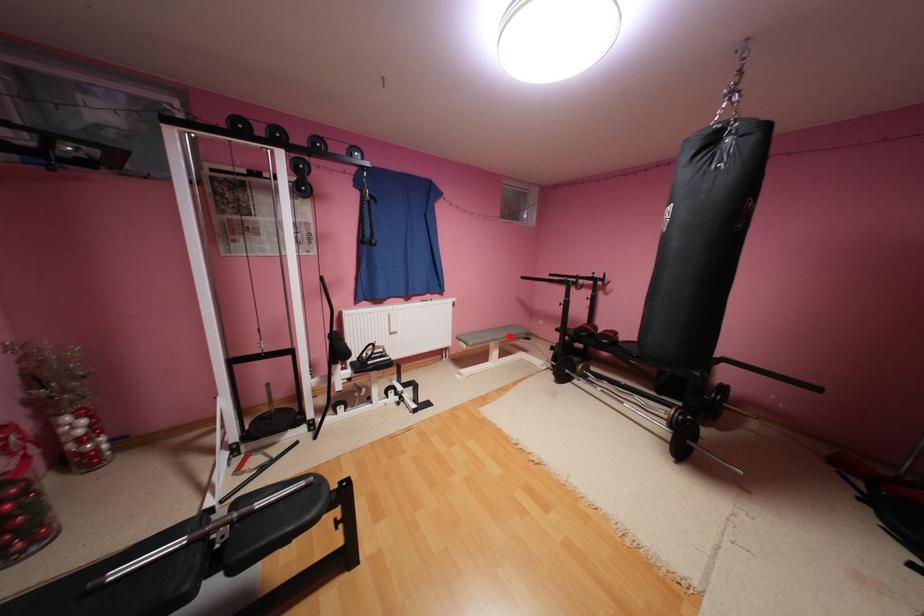
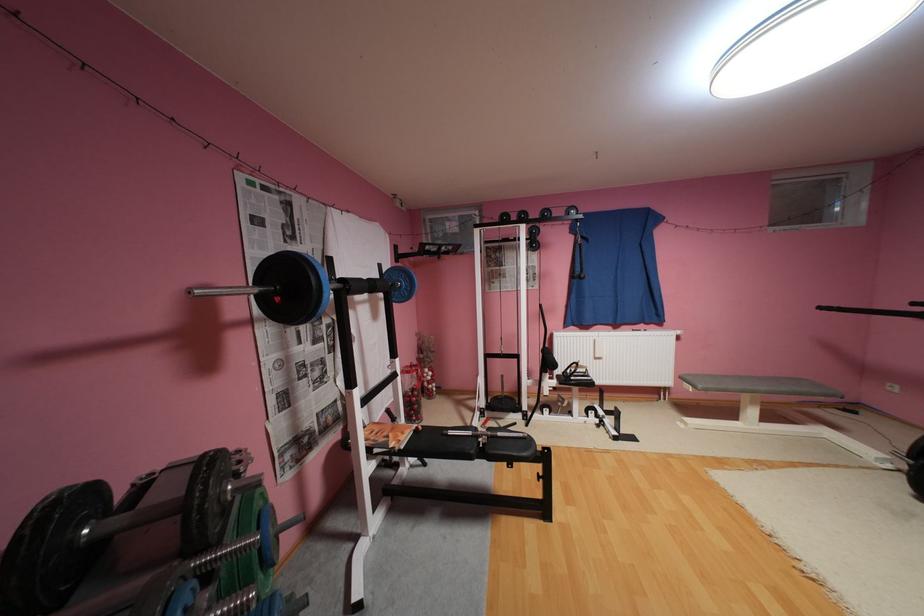
Find the pixel in the second image that matches the highlighted location in the first image.

(771, 387)